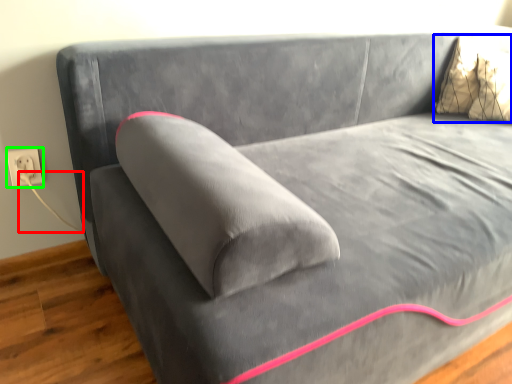
Question: Estimate the real-world distances between objects in this image. Which object is farther from string (highlighted by a red box), pillow (highlighted by a blue box) or electric outlet (highlighted by a green box)?

Choices:
 (A) pillow
 (B) electric outlet

Answer: (A)